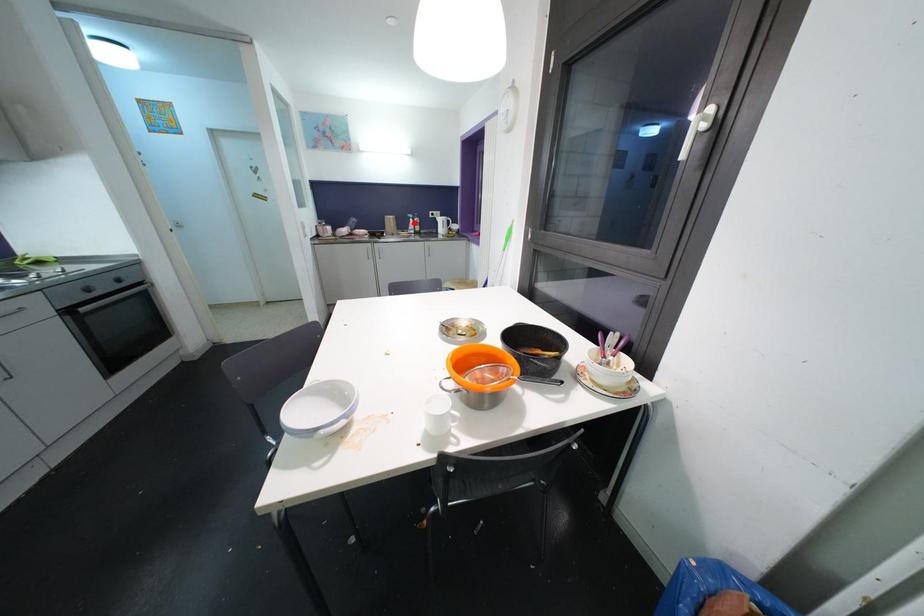
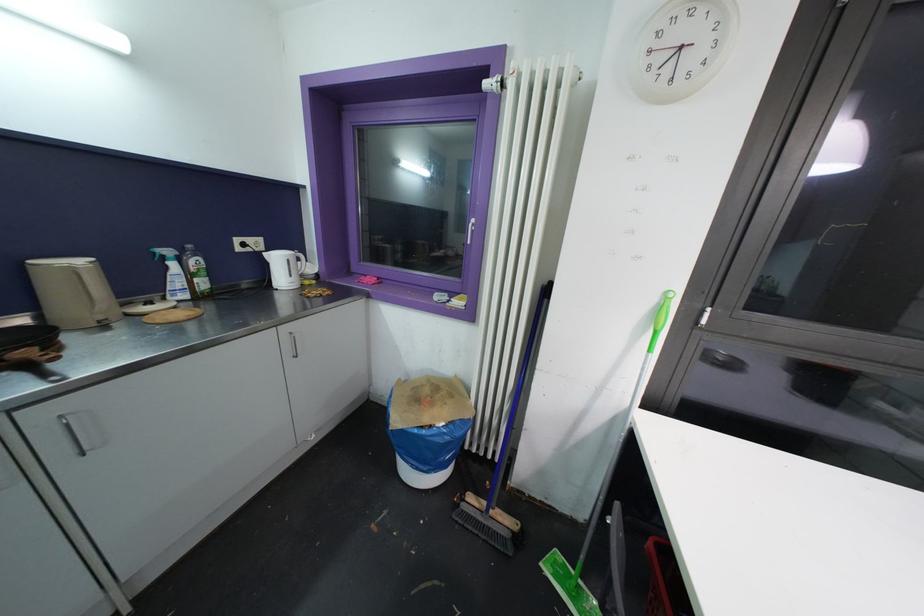
Question: A red point is marked in image1. In image2, is the corresponding 3D point closer to the camera or farther? Reply with the corresponding letter.

Choices:
 (A) The corresponding 3D point is closer.
 (B) The corresponding 3D point is farther.

Answer: (B)